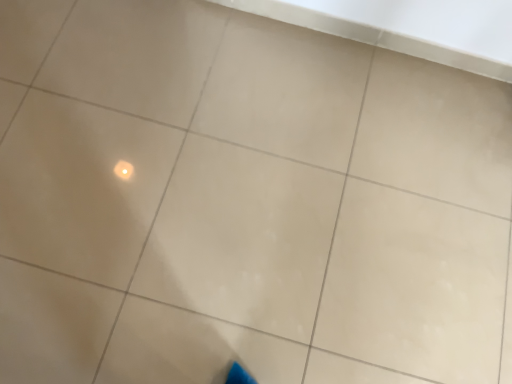
Identify the location of free space in front of white glossy bathtub at upper right. Image resolution: width=512 pixels, height=384 pixels. (308, 188).